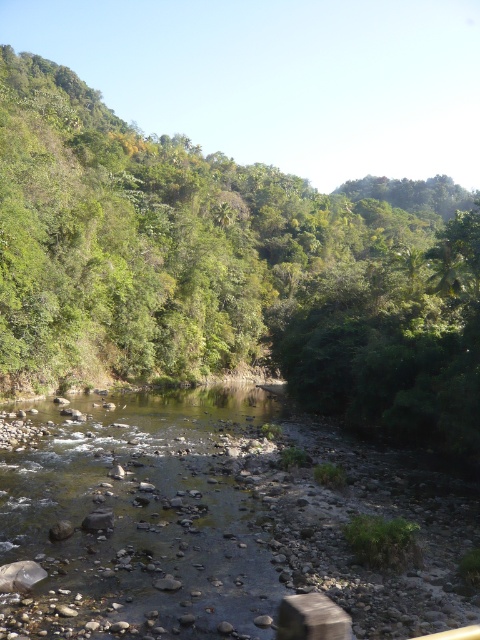
Question: Does green leafy tree at center appear over clear water at center?

Choices:
 (A) yes
 (B) no

Answer: (A)

Question: Among these objects, which one is nearest to the camera?

Choices:
 (A) green leafy tree at center
 (B) clear water at center

Answer: (B)

Question: Is green leafy tree at center smaller than clear water at center?

Choices:
 (A) no
 (B) yes

Answer: (A)

Question: Does green leafy tree at center have a smaller size compared to clear water at center?

Choices:
 (A) no
 (B) yes

Answer: (A)

Question: Among these objects, which one is nearest to the camera?

Choices:
 (A) clear water at center
 (B) green leafy tree at center

Answer: (A)